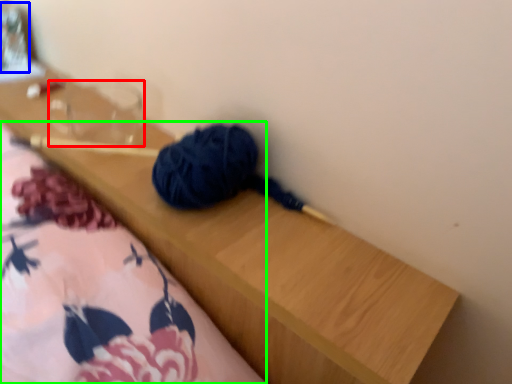
Question: Considering the real-world distances, which object is farthest from clear (highlighted by a red box)? glass jar (highlighted by a blue box) or blanket (highlighted by a green box)?

Choices:
 (A) glass jar
 (B) blanket

Answer: (B)